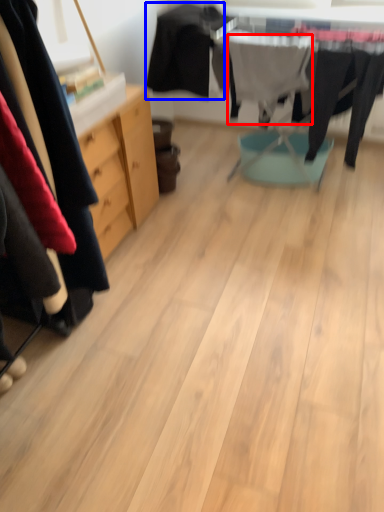
Question: Which object is further to the camera taking this photo, clothing (highlighted by a red box) or clothing (highlighted by a blue box)?

Choices:
 (A) clothing
 (B) clothing

Answer: (B)